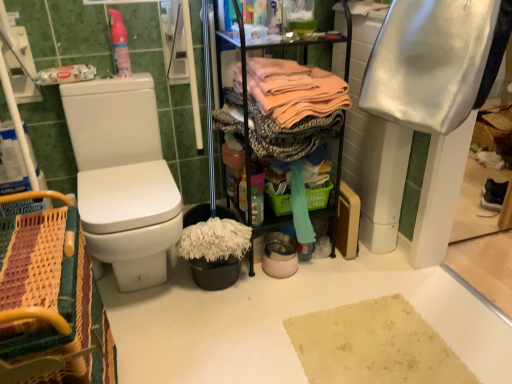
Image resolution: width=512 pixels, height=384 pixels. Identify the location of free spot to the left of black plastic bucket at lower center. [149, 287].